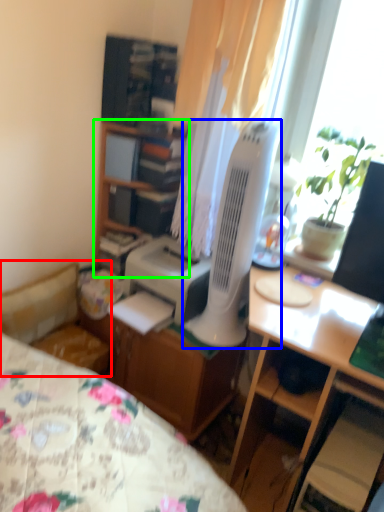
Question: Estimate the real-world distances between objects in this image. Which object is farther from studio couch (highlighted by a red box), mechanical fan (highlighted by a blue box) or cabinetry (highlighted by a green box)?

Choices:
 (A) mechanical fan
 (B) cabinetry

Answer: (A)